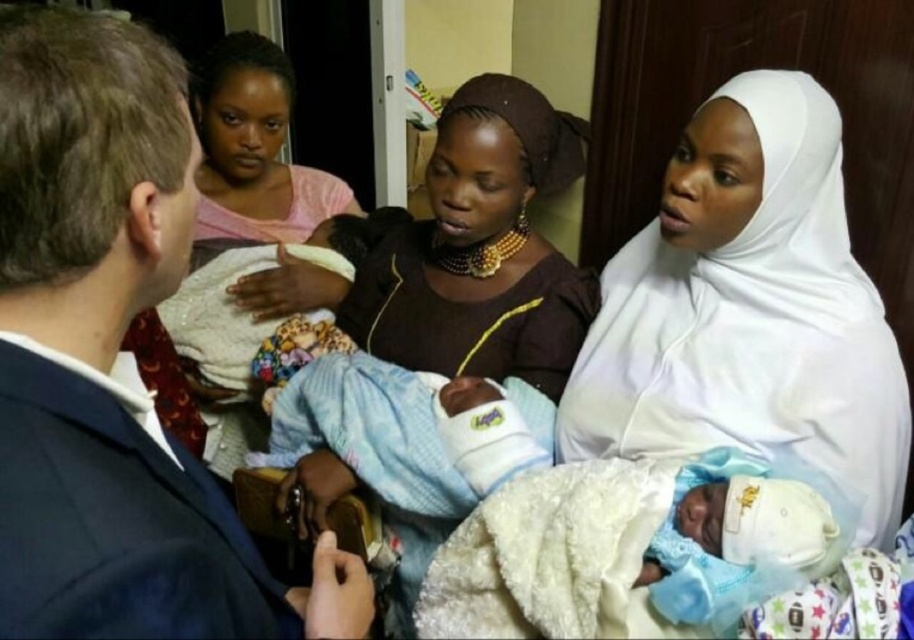
Question: Observing the image, what is the correct spatial positioning of blue suit jacket at left in reference to white cloth at center?

Choices:
 (A) left
 (B) right

Answer: (A)

Question: Which of the following is the farthest from the observer?

Choices:
 (A) (594, 396)
 (B) (117, 566)

Answer: (A)

Question: Is blue suit jacket at left smaller than white cloth at center?

Choices:
 (A) no
 (B) yes

Answer: (B)

Question: Which point is farther to the camera?

Choices:
 (A) (750, 97)
 (B) (52, 410)

Answer: (A)

Question: Is blue suit jacket at left below white cloth at center?

Choices:
 (A) yes
 (B) no

Answer: (A)